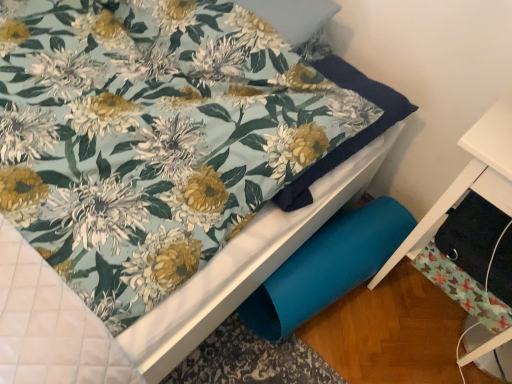
Question: Is black fabric drawer at lower right a part of black fabric drawer at lower right?

Choices:
 (A) no
 (B) yes

Answer: (A)

Question: Is black fabric drawer at lower right behind black fabric drawer at lower right?

Choices:
 (A) no
 (B) yes

Answer: (B)

Question: Is black fabric drawer at lower right oriented away from black fabric drawer at lower right?

Choices:
 (A) no
 (B) yes

Answer: (B)

Question: Is black fabric drawer at lower right not near black fabric drawer at lower right?

Choices:
 (A) no
 (B) yes

Answer: (A)

Question: From the image's perspective, is black fabric drawer at lower right under black fabric drawer at lower right?

Choices:
 (A) yes
 (B) no

Answer: (B)

Question: Does black fabric drawer at lower right lie in front of black fabric drawer at lower right?

Choices:
 (A) yes
 (B) no

Answer: (B)

Question: Does black fabric drawer at lower right have a larger size compared to black fabric drawer at lower right?

Choices:
 (A) yes
 (B) no

Answer: (A)

Question: Is black fabric drawer at lower right facing towards black fabric drawer at lower right?

Choices:
 (A) no
 (B) yes

Answer: (B)

Question: Is black fabric drawer at lower right surrounded by black fabric drawer at lower right?

Choices:
 (A) no
 (B) yes

Answer: (B)

Question: Considering the relative positions of black fabric drawer at lower right and black fabric drawer at lower right in the image provided, is black fabric drawer at lower right in front of black fabric drawer at lower right?

Choices:
 (A) yes
 (B) no

Answer: (A)

Question: Can you confirm if black fabric drawer at lower right is thinner than black fabric drawer at lower right?

Choices:
 (A) no
 (B) yes

Answer: (A)

Question: From the image's perspective, is black fabric drawer at lower right over black fabric drawer at lower right?

Choices:
 (A) yes
 (B) no

Answer: (B)

Question: From a real-world perspective, is black fabric drawer at lower right above or below black fabric drawer at lower right?

Choices:
 (A) below
 (B) above

Answer: (A)